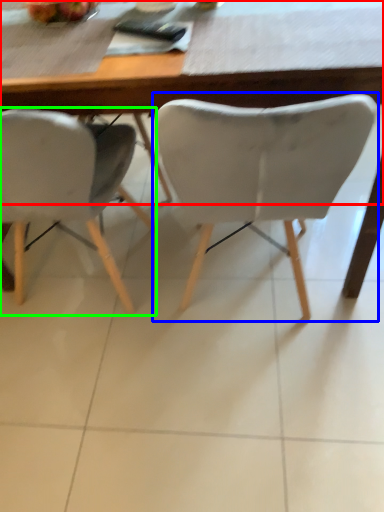
Question: Which object is positioned closest to table (highlighted by a red box)? Select from chair (highlighted by a blue box) and chair (highlighted by a green box).

Choices:
 (A) chair
 (B) chair

Answer: (A)